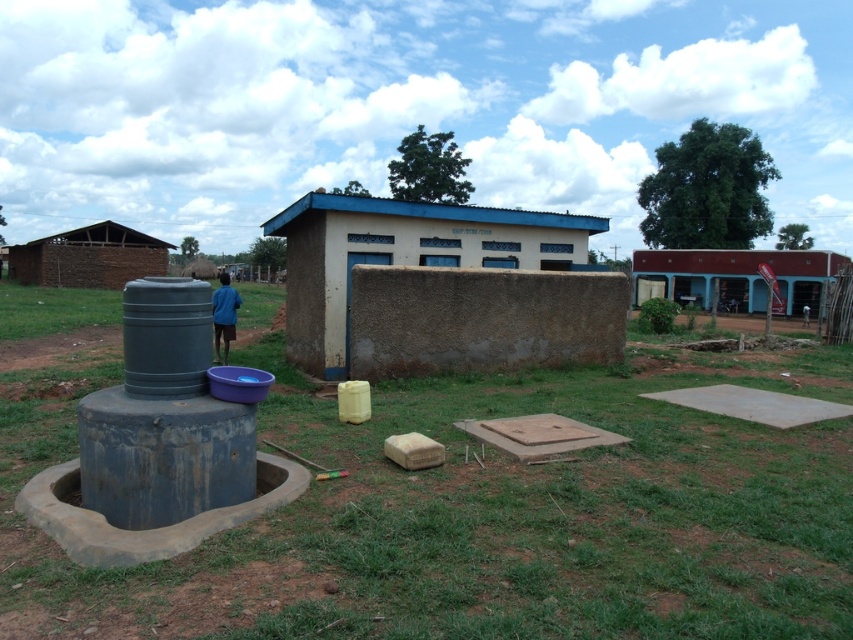
You are standing at the point marked as point (x=402, y=256) in the image. What structure are you currently standing on?

You are standing on the brown mud hut at center.